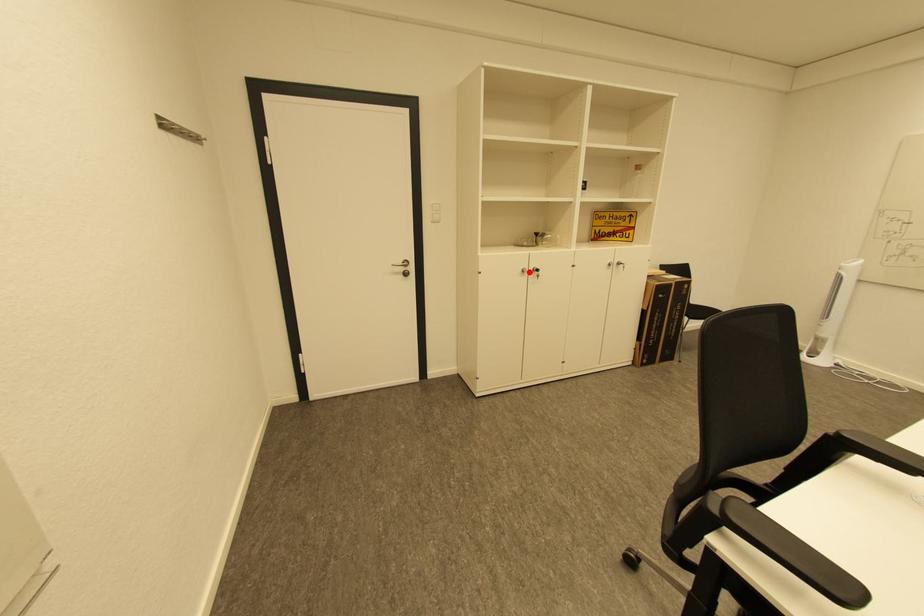
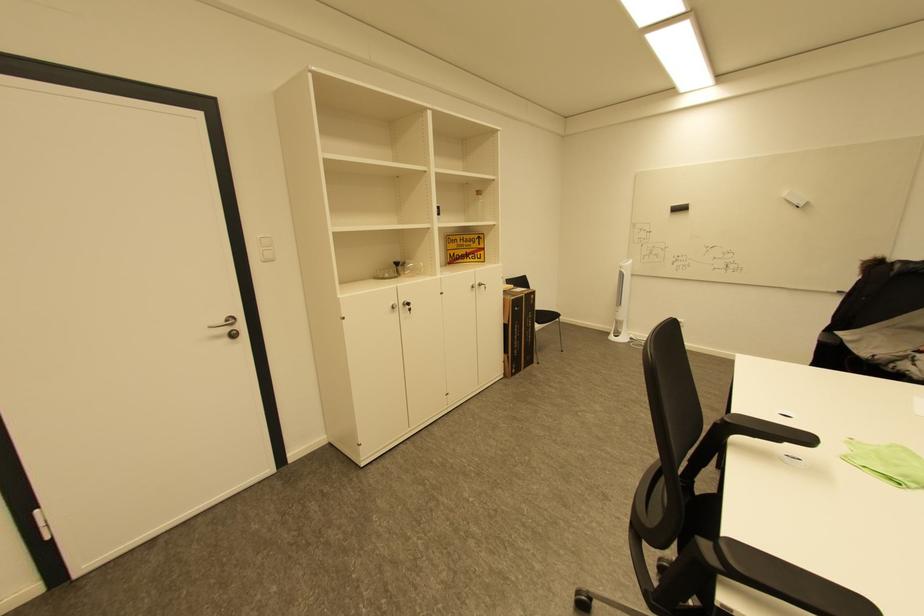
Where in the second image is the point corresponding to the highlighted location from the first image?

(398, 308)